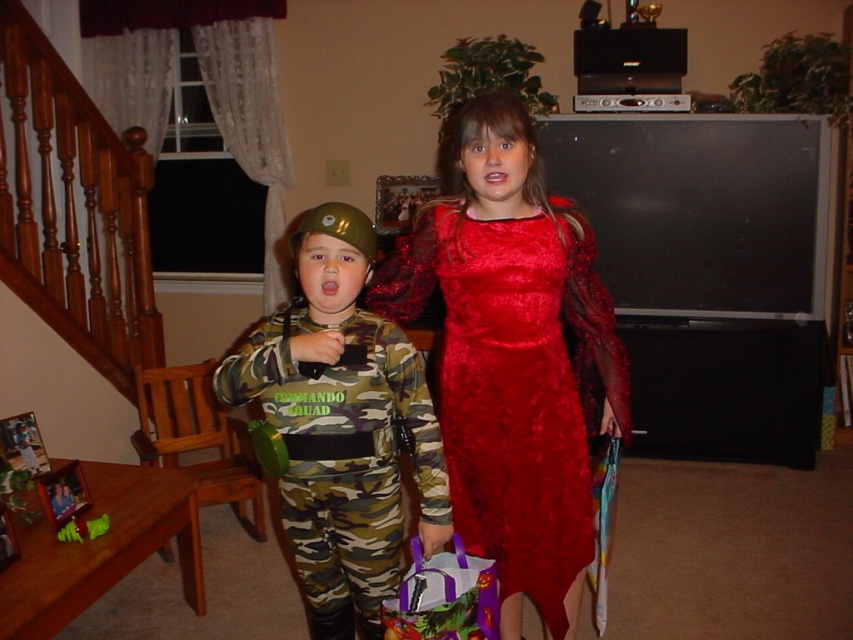
Which is more to the right, shiny red dress at center or camo fabric uniform at center?

Positioned to the right is shiny red dress at center.

Does shiny red dress at center have a smaller size compared to camo fabric uniform at center?

Incorrect, shiny red dress at center is not smaller in size than camo fabric uniform at center.

Where is `shiny red dress at center`? The image size is (853, 640). shiny red dress at center is located at coordinates (514, 356).